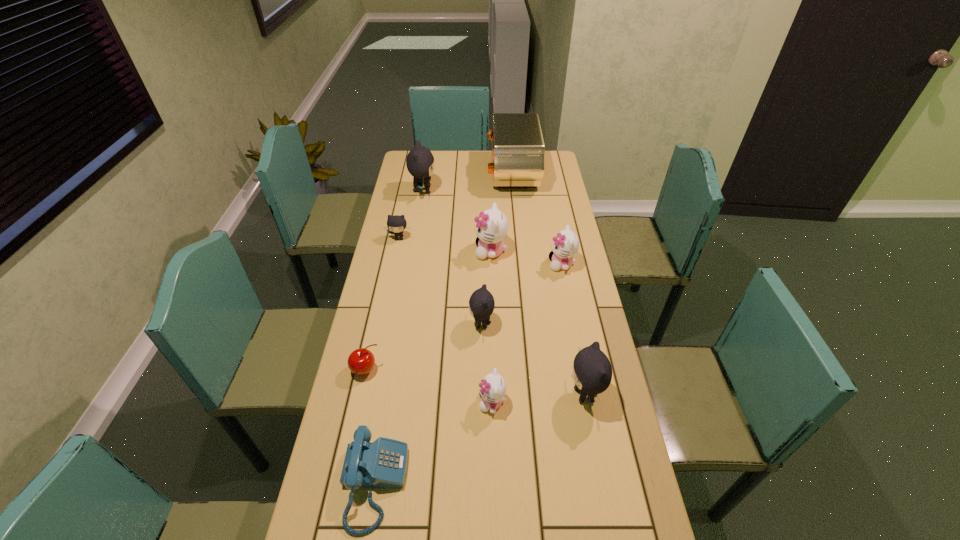
At what (x,y) coordinates should I click in order to perform the action: click on vacant space in between the third smallest gray kitten and the second smallest gray kitten. Please return your answer as a coordinate pair (x, y). Image resolution: width=960 pixels, height=540 pixels. Looking at the image, I should click on pyautogui.click(x=533, y=360).

Locate an element on the screen. Image resolution: width=960 pixels, height=540 pixels. free spot between the telephone and the biggest white kitten is located at coordinates (432, 368).

You are a GUI agent. You are given a task and a screenshot of the screen. Output one action in this format:
    pyautogui.click(x=<x>, y=<y>)
    Task: Click on the free area in between the smallest white kitten and the nearest object
    This screenshot has height=540, width=960.
    Given the screenshot: What is the action you would take?
    pyautogui.click(x=433, y=443)

Identify the location of vacant area between the telephone and the smallest white kitten. The image size is (960, 540). (433, 443).

This screenshot has height=540, width=960. Find the location of `blank region between the telephone and the second biggest white kitten`. blank region between the telephone and the second biggest white kitten is located at coordinates (468, 374).

I want to click on object that is the ninth closest to the farthest gray kitten, so click(383, 463).

Where is `object that stands as the closest to the third smallest gray kitten`? The image size is (960, 540). object that stands as the closest to the third smallest gray kitten is located at coordinates (492, 388).

Find the location of a particular element. Image resolution: width=960 pixels, height=540 pixels. kitten identified as the closest to the second farthest gray kitten is located at coordinates (420, 162).

Find the location of a particular element. The width and height of the screenshot is (960, 540). kitten that stands as the second closest to the toaster oven is located at coordinates (492, 226).

Select which gray kitten is the third closest to the cherry. Please provide its 2D coordinates. Your answer should be formatted as a tuple, i.e. [(x, y)], where the tuple contains the x and y coordinates of a point satisfying the conditions above.

[(396, 223)]